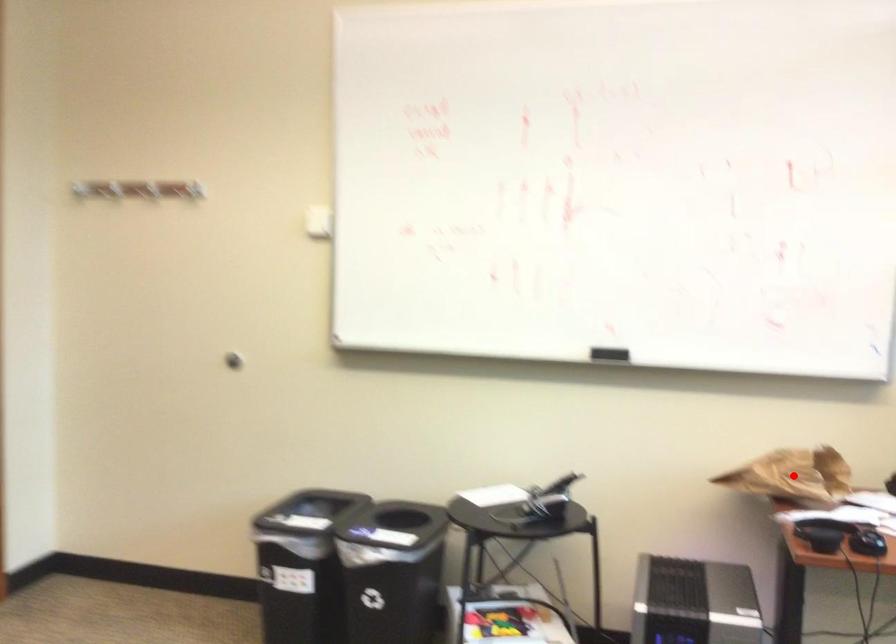
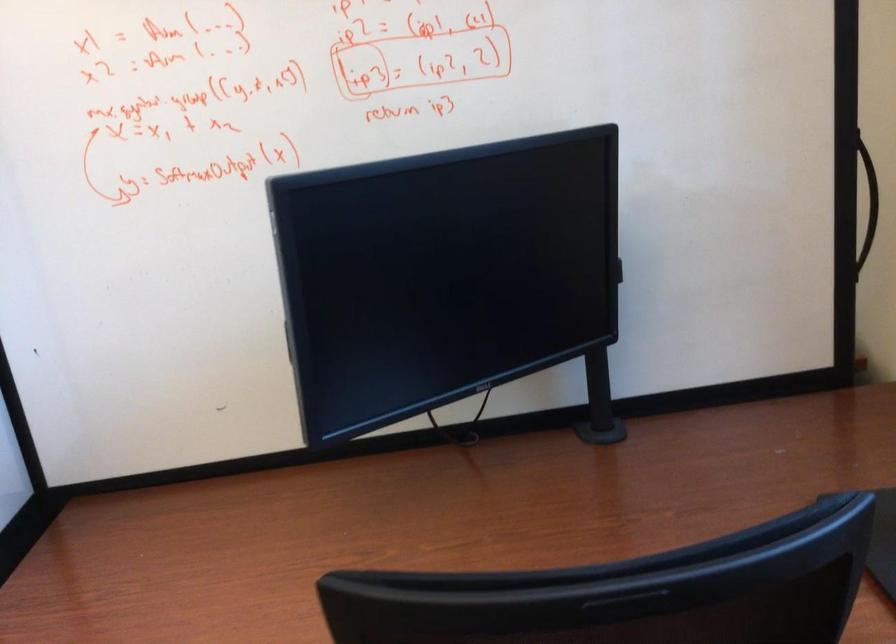
Question: I am providing you with two images of the same scene from different viewpoints. A red point is marked on the first image. Is the red point's position out of view in image 2?

Choices:
 (A) Yes
 (B) No

Answer: (A)